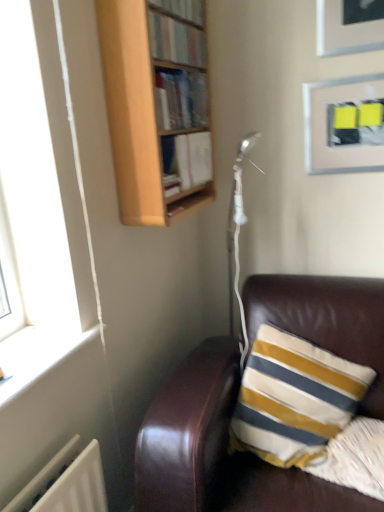
Question: Is the position of hardcover book at upper center, the first book when ordered from bottom to top, more distant than that of striped fabric pillow at lower right?

Choices:
 (A) yes
 (B) no

Answer: (A)

Question: From the image's perspective, is hardcover book at upper center, the first book when ordered from bottom to top, over striped fabric pillow at lower right?

Choices:
 (A) yes
 (B) no

Answer: (A)

Question: From a real-world perspective, is hardcover book at upper center, the first book when ordered from bottom to top, positioned under striped fabric pillow at lower right based on gravity?

Choices:
 (A) no
 (B) yes

Answer: (A)

Question: Considering the relative sizes of hardcover book at upper center, the third book when ordered from top to bottom, and striped fabric pillow at lower right in the image provided, is hardcover book at upper center, the third book when ordered from top to bottom, taller than striped fabric pillow at lower right?

Choices:
 (A) yes
 (B) no

Answer: (B)

Question: Does hardcover book at upper center, the third book when ordered from top to bottom, have a lesser width compared to striped fabric pillow at lower right?

Choices:
 (A) yes
 (B) no

Answer: (A)

Question: From the image's perspective, is hardcover book at upper center, the third book when ordered from top to bottom, located above or below striped fabric pillow at lower right?

Choices:
 (A) above
 (B) below

Answer: (A)

Question: Is point (208, 179) positioned closer to the camera than point (375, 456)?

Choices:
 (A) farther
 (B) closer

Answer: (A)

Question: Considering the positions of hardcover book at upper center, the first book when ordered from bottom to top, and striped fabric pillow at lower right in the image, is hardcover book at upper center, the first book when ordered from bottom to top, bigger or smaller than striped fabric pillow at lower right?

Choices:
 (A) big
 (B) small

Answer: (B)

Question: Is hardcover book at upper center, the first book when ordered from bottom to top, in front of or behind striped fabric pillow at lower right in the image?

Choices:
 (A) behind
 (B) front

Answer: (A)

Question: Do you think wooden bookshelf at upper center, which appears as the 2th book when viewed from the top, is within hardcover book at upper center, the first book when ordered from bottom to top, or outside of it?

Choices:
 (A) outside
 (B) inside

Answer: (A)

Question: Visually, is wooden bookshelf at upper center, the second book ordered from the bottom, positioned to the left or to the right of hardcover book at upper center, the first book when ordered from bottom to top?

Choices:
 (A) right
 (B) left

Answer: (B)

Question: From the image's perspective, is wooden bookshelf at upper center, which appears as the 2th book when viewed from the top, above or below hardcover book at upper center, the third book when ordered from top to bottom?

Choices:
 (A) above
 (B) below

Answer: (A)

Question: Looking at the image, does wooden bookshelf at upper center, the second book ordered from the bottom, seem bigger or smaller compared to hardcover book at upper center, the third book when ordered from top to bottom?

Choices:
 (A) big
 (B) small

Answer: (A)

Question: From the image's perspective, is striped fabric pillow at lower right above or below brown leather couch at lower right?

Choices:
 (A) above
 (B) below

Answer: (A)

Question: Relative to brown leather couch at lower right, is striped fabric pillow at lower right in front or behind?

Choices:
 (A) behind
 (B) front

Answer: (A)